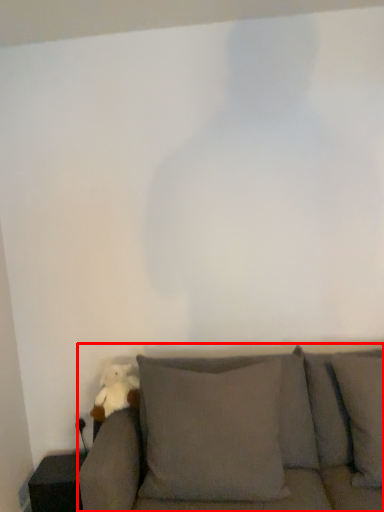
Question: Considering the relative positions of studio couch (annotated by the red box) and toy in the image provided, where is studio couch (annotated by the red box) located with respect to the staircase?

Choices:
 (A) right
 (B) left

Answer: (A)